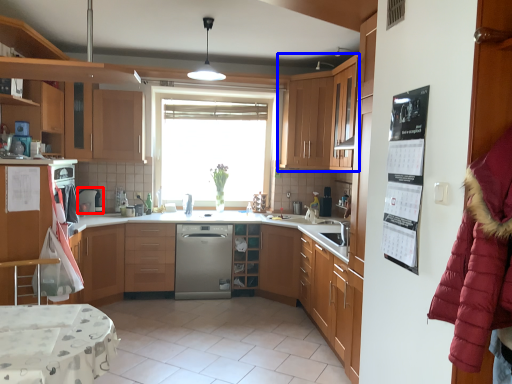
Question: Among these objects, which one is farthest to the camera, appliance (highlighted by a red box) or cabinetry (highlighted by a blue box)?

Choices:
 (A) appliance
 (B) cabinetry

Answer: (A)